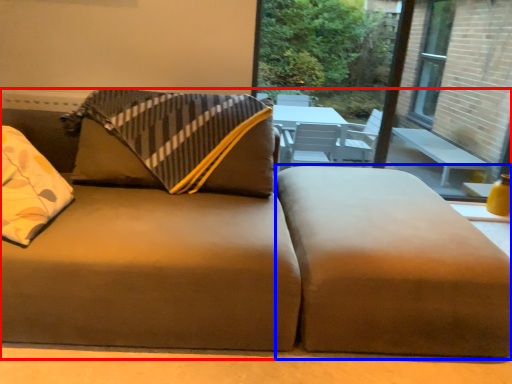
Question: Which object appears farthest to the camera in this image, studio couch (highlighted by a red box) or footrest (highlighted by a blue box)?

Choices:
 (A) studio couch
 (B) footrest

Answer: (B)